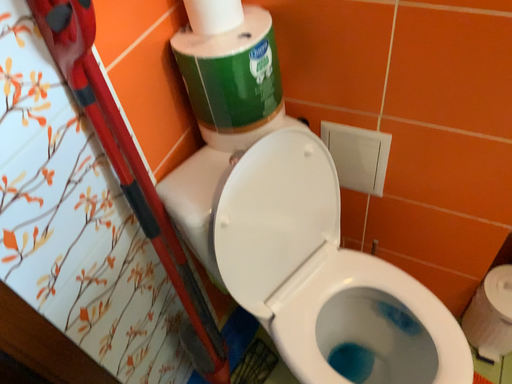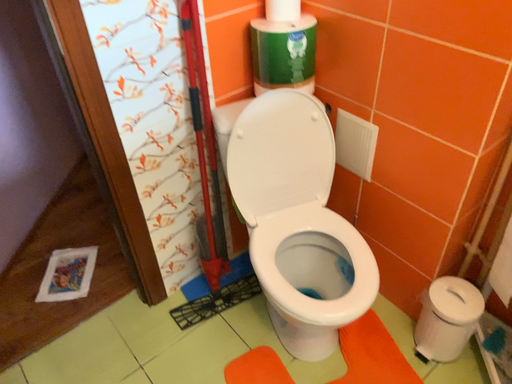
Question: How did the camera likely rotate when shooting the video?

Choices:
 (A) rotated left
 (B) rotated right

Answer: (A)